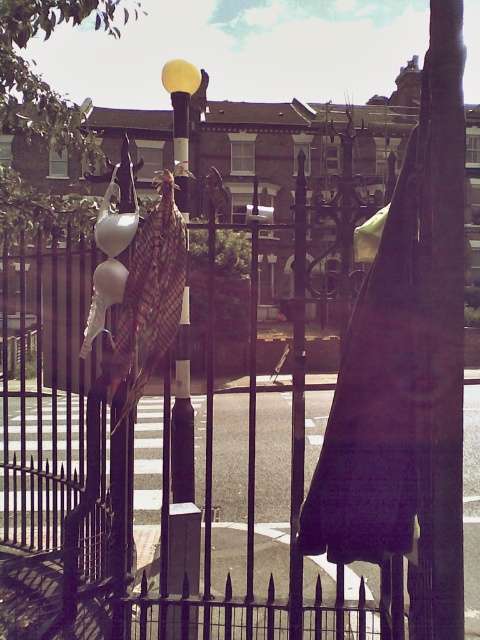
Question: Which point is farther from the camera taking this photo?

Choices:
 (A) (106, 284)
 (B) (120, 234)

Answer: (A)

Question: Based on their relative distances, which object is nearer to the matte white balloon at center?

Choices:
 (A) plaid fabric umbrella at center
 (B) white glossy balloon at center
 (C) matte black umbrella at center

Answer: (B)

Question: Which of the following is the closest to the observer?

Choices:
 (A) plaid fabric umbrella at center
 (B) matte white balloon at center
 (C) white glossy balloon at center
 (D) matte black umbrella at center

Answer: (D)

Question: Is matte black umbrella at center above plaid fabric umbrella at center?

Choices:
 (A) yes
 (B) no

Answer: (B)

Question: Can you confirm if matte black umbrella at center is bigger than plaid fabric umbrella at center?

Choices:
 (A) yes
 (B) no

Answer: (B)

Question: Is matte black umbrella at center positioned before plaid fabric umbrella at center?

Choices:
 (A) yes
 (B) no

Answer: (A)